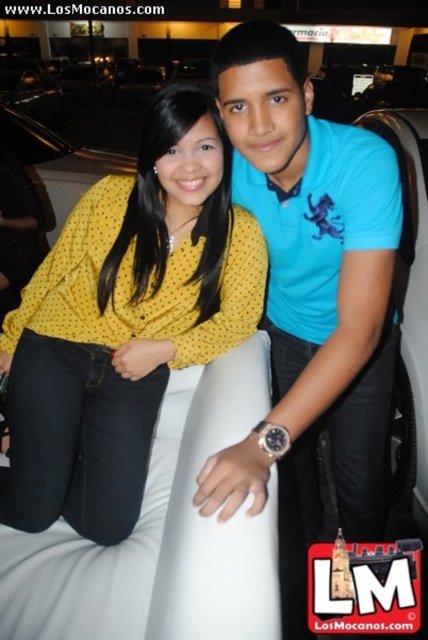
Looking at this image, you are a photographer trying to ensure both subjects are clearly visible in the photo. Given that the yellow dotted shirt at center and the blue cotton shirt at center are both in the center, which one might appear smaller in the final image?

The yellow dotted shirt at center has a smaller size compared to the blue cotton shirt at center, so it will appear smaller in the final image.

You are a photographer trying to focus on the yellow dotted shirt at center and the blue cotton shirt at center. Which one should you adjust the camera focus to first if you want to focus on the one that is higher in the image?

The yellow dotted shirt at center is above the blue cotton shirt at center, so you should adjust the camera focus to the yellow dotted shirt at center first since it is higher in the image.